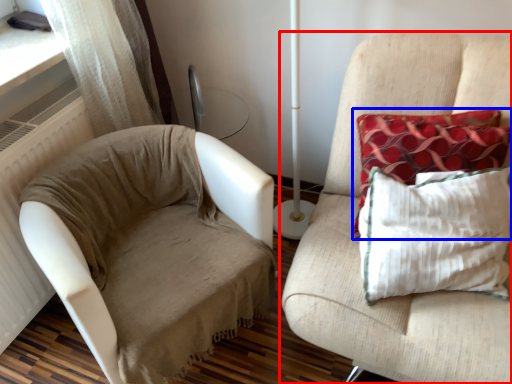
Question: Which of the following is the closest to the observer, furniture (highlighted by a red box) or pillow (highlighted by a blue box)?

Choices:
 (A) furniture
 (B) pillow

Answer: (A)